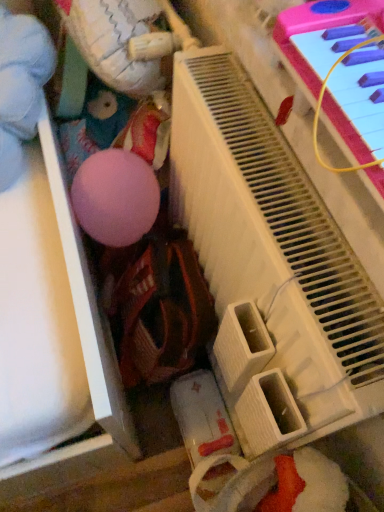
What do you see at coordinates (270, 265) in the screenshot?
I see `pink plastic piano at upper right` at bounding box center [270, 265].

I want to click on white matte plush at upper left, the second toy from the left, so click(x=117, y=42).

Which is more to the right, matte pink ball at upper left, the second toy when ordered from right to left, or white matte plush at upper left, the second toy from the left?

white matte plush at upper left, the second toy from the left, is more to the right.

Can you tell me how much matte pink ball at upper left, the second toy when ordered from right to left, and white matte plush at upper left, the second toy from the left, differ in facing direction?

The angular difference between matte pink ball at upper left, the second toy when ordered from right to left, and white matte plush at upper left, the second toy from the left, is 0.000251 degrees.

Between matte pink ball at upper left, the second toy when ordered from right to left, and white matte plush at upper left, the second toy from the left, which one has larger width?

matte pink ball at upper left, the second toy when ordered from right to left.

The height and width of the screenshot is (512, 384). In the image, there is a white matte plush at upper left, which ranks as the 1th toy in right-to-left order. In order to click on toy below it (from the image's perspective) in this screenshot , I will do point(21,86).

Considering the relative sizes of white matte plush at upper left, the second toy from the left, and matte pink ball at upper left, the second toy when ordered from right to left, in the image provided, is white matte plush at upper left, the second toy from the left, thinner than matte pink ball at upper left, the second toy when ordered from right to left,?

Yes, white matte plush at upper left, the second toy from the left, is thinner than matte pink ball at upper left, the second toy when ordered from right to left.

From a real-world perspective, who is located lower, white matte plush at upper left, which ranks as the 1th toy in right-to-left order, or matte pink ball at upper left, the 1th toy positioned from the left?

From a 3D spatial view, matte pink ball at upper left, the 1th toy positioned from the left, is below.

Can you tell me how much white matte plush at upper left, which ranks as the 1th toy in right-to-left order, and matte pink ball at upper left, the 1th toy positioned from the left, differ in facing direction?

0.000251 degrees separate the facing orientations of white matte plush at upper left, which ranks as the 1th toy in right-to-left order, and matte pink ball at upper left, the 1th toy positioned from the left.

Considering the positions of objects white matte plush at upper left, the second toy from the left, and matte pink ball at upper left, the second toy when ordered from right to left, in the image provided, who is in front, white matte plush at upper left, the second toy from the left, or matte pink ball at upper left, the second toy when ordered from right to left,?

white matte plush at upper left, the second toy from the left, is closer to the camera.

Is point (356, 355) positioned after point (3, 134)?

That is False.

At what (x,y) coordinates should I click in order to perform the action: click on piano located on the right of matte pink ball at upper left, the 1th toy positioned from the left. Please return your answer as a coordinate pair (x, y). Looking at the image, I should click on (270, 265).

Consider the image. Is pink plastic piano at upper right aimed at matte pink ball at upper left, the 1th toy positioned from the left?

Yes, pink plastic piano at upper right is facing matte pink ball at upper left, the 1th toy positioned from the left.

Is pink plastic piano at upper right surrounding matte pink ball at upper left, the second toy when ordered from right to left?

No, matte pink ball at upper left, the second toy when ordered from right to left, is located outside of pink plastic piano at upper right.

From a real-world perspective, is pink plastic piano at upper right positioned above or below white matte plush at upper left, the second toy from the left?

pink plastic piano at upper right is below white matte plush at upper left, the second toy from the left.

Is pink plastic piano at upper right touching white matte plush at upper left, which ranks as the 1th toy in right-to-left order?

No, pink plastic piano at upper right is not next to white matte plush at upper left, which ranks as the 1th toy in right-to-left order.

Can you confirm if pink plastic piano at upper right is taller than white matte plush at upper left, the second toy from the left?

Correct, pink plastic piano at upper right is much taller as white matte plush at upper left, the second toy from the left.

Consider the image. Does pink plastic piano at upper right have a lesser width compared to white matte plush at upper left, which ranks as the 1th toy in right-to-left order?

Indeed, pink plastic piano at upper right has a lesser width compared to white matte plush at upper left, which ranks as the 1th toy in right-to-left order.

Considering the points (9, 70) and (196, 248), which point is behind, point (9, 70) or point (196, 248)?

Point (196, 248)

Looking at this image, is matte pink ball at upper left, the second toy when ordered from right to left, wider than pink plastic piano at upper right?

Correct, the width of matte pink ball at upper left, the second toy when ordered from right to left, exceeds that of pink plastic piano at upper right.

Which object is further away from the camera, matte pink ball at upper left, the second toy when ordered from right to left, or pink plastic piano at upper right?

Positioned behind is matte pink ball at upper left, the second toy when ordered from right to left.

From a real-world perspective, which is physically below, matte pink ball at upper left, the second toy when ordered from right to left, or pink plastic piano at upper right?

From a 3D spatial view, pink plastic piano at upper right is below.

Could you tell me if white matte plush at upper left, the second toy from the left, is turned towards pink plastic piano at upper right?

No.

Which object is more forward, white matte plush at upper left, which ranks as the 1th toy in right-to-left order, or pink plastic piano at upper right?

pink plastic piano at upper right.

Considering the points (125, 72) and (299, 346), which point is in front, point (125, 72) or point (299, 346)?

Positioned in front is point (299, 346).

Considering the relative positions of white matte plush at upper left, the second toy from the left, and pink plastic piano at upper right in the image provided, is white matte plush at upper left, the second toy from the left, to the left of pink plastic piano at upper right from the viewer's perspective?

Yes.

Where is `toy below the white matte plush at upper left, which ranks as the 1th toy in right-to-left order (from the image's perspective)`? toy below the white matte plush at upper left, which ranks as the 1th toy in right-to-left order (from the image's perspective) is located at coordinates (21, 86).

At what (x,y) coordinates should I click in order to perform the action: click on toy in front of the matte pink ball at upper left, the second toy when ordered from right to left. Please return your answer as a coordinate pair (x, y). This screenshot has width=384, height=512. Looking at the image, I should click on (117, 42).

From the image, which object appears to be nearer to matte pink ball at upper left, the 1th toy positioned from the left, pink plastic piano at upper right or white matte plush at upper left, the second toy from the left?

white matte plush at upper left, the second toy from the left.

Looking at the image, which one is located further to pink plastic piano at upper right, matte pink ball at upper left, the second toy when ordered from right to left, or white matte plush at upper left, which ranks as the 1th toy in right-to-left order?

Among the two, matte pink ball at upper left, the second toy when ordered from right to left, is located further to pink plastic piano at upper right.

From the image, which object appears to be farther from pink plastic piano at upper right, white matte plush at upper left, the second toy from the left, or matte pink ball at upper left, the second toy when ordered from right to left?

The object further to pink plastic piano at upper right is matte pink ball at upper left, the second toy when ordered from right to left.

Looking at the image, which one is located closer to white matte plush at upper left, which ranks as the 1th toy in right-to-left order, matte pink ball at upper left, the second toy when ordered from right to left, or pink plastic piano at upper right?

matte pink ball at upper left, the second toy when ordered from right to left, lies closer to white matte plush at upper left, which ranks as the 1th toy in right-to-left order, than the other object.

When comparing their distances from matte pink ball at upper left, the second toy when ordered from right to left, does white matte plush at upper left, which ranks as the 1th toy in right-to-left order, or pink plastic piano at upper right seem further?

pink plastic piano at upper right.

Considering their positions, is pink plastic piano at upper right positioned closer to white matte plush at upper left, the second toy from the left, than matte pink ball at upper left, the second toy when ordered from right to left?

Based on the image, matte pink ball at upper left, the second toy when ordered from right to left, appears to be nearer to white matte plush at upper left, the second toy from the left.

This screenshot has height=512, width=384. In order to click on toy between white matte plush at upper left, the second toy from the left, and pink plastic piano at upper right, in the vertical direction in this screenshot , I will do `click(21, 86)`.